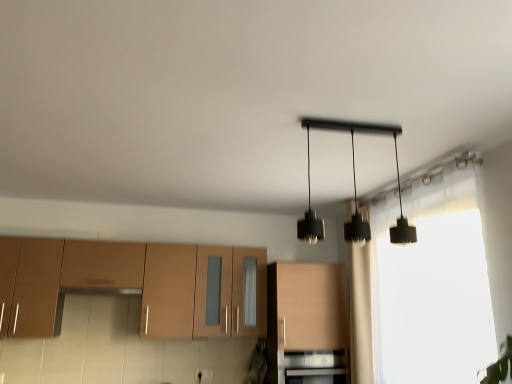
Question: Is brown matte cabinet at lower left, the second cabinetry in the right-to-left sequence, looking in the opposite direction of black matte pendant lights at center?

Choices:
 (A) no
 (B) yes

Answer: (A)

Question: From the image's perspective, is brown matte cabinet at lower left, marked as the 1th cabinetry in a left-to-right arrangement, below black matte pendant lights at center?

Choices:
 (A) no
 (B) yes

Answer: (B)

Question: Is brown matte cabinet at lower left, the second cabinetry in the right-to-left sequence, located outside black matte pendant lights at center?

Choices:
 (A) no
 (B) yes

Answer: (B)

Question: From a real-world perspective, is brown matte cabinet at lower left, marked as the 1th cabinetry in a left-to-right arrangement, below black matte pendant lights at center?

Choices:
 (A) no
 (B) yes

Answer: (B)

Question: Is brown matte cabinet at lower left, marked as the 1th cabinetry in a left-to-right arrangement, closer to the viewer compared to black matte pendant lights at center?

Choices:
 (A) no
 (B) yes

Answer: (A)

Question: From a real-world perspective, is brown matte cabinet at lower left, marked as the 1th cabinetry in a left-to-right arrangement, above or below black matte pendant lights at center?

Choices:
 (A) below
 (B) above

Answer: (A)

Question: Considering their positions, is brown matte cabinet at lower left, the second cabinetry in the right-to-left sequence, located in front of or behind black matte pendant lights at center?

Choices:
 (A) front
 (B) behind

Answer: (B)

Question: Considering the positions of brown matte cabinet at lower left, marked as the 1th cabinetry in a left-to-right arrangement, and black matte pendant lights at center in the image, is brown matte cabinet at lower left, marked as the 1th cabinetry in a left-to-right arrangement, wider or thinner than black matte pendant lights at center?

Choices:
 (A) thin
 (B) wide

Answer: (A)

Question: From their relative heights in the image, would you say brown matte cabinet at lower left, marked as the 1th cabinetry in a left-to-right arrangement, is taller or shorter than black matte pendant lights at center?

Choices:
 (A) short
 (B) tall

Answer: (B)

Question: Is point (336, 365) positioned closer to the camera than point (284, 278)?

Choices:
 (A) farther
 (B) closer

Answer: (B)

Question: In the image, is black matte oven at lower center on the left side or the right side of matte wood cabinet at center, the 1th cabinetry positioned from the right?

Choices:
 (A) right
 (B) left

Answer: (B)

Question: From the image's perspective, is black matte oven at lower center located above or below matte wood cabinet at center, the 1th cabinetry positioned from the right?

Choices:
 (A) below
 (B) above

Answer: (A)

Question: In the image, is black matte oven at lower center positioned in front of or behind matte wood cabinet at center, the 1th cabinetry positioned from the right?

Choices:
 (A) behind
 (B) front

Answer: (B)

Question: From the image's perspective, relative to translucent fabric curtain at right, is black matte pendant lights at center above or below?

Choices:
 (A) below
 (B) above

Answer: (B)

Question: Is point (349, 225) closer or farther from the camera than point (436, 372)?

Choices:
 (A) farther
 (B) closer

Answer: (B)